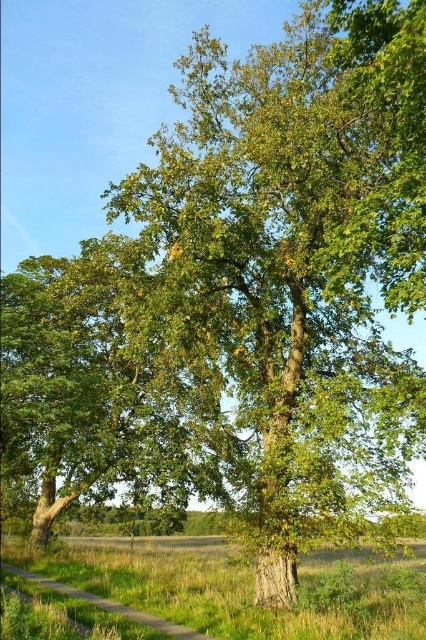
Question: Which point is farther to the camera?

Choices:
 (A) (184, 634)
 (B) (356, 612)

Answer: (A)

Question: Considering the relative positions of green grass at lower left and green grassy path at lower left in the image provided, where is green grass at lower left located with respect to green grassy path at lower left?

Choices:
 (A) left
 (B) right

Answer: (B)

Question: Is green grass at lower left to the left of green grassy path at lower left from the viewer's perspective?

Choices:
 (A) yes
 (B) no

Answer: (B)

Question: Can you confirm if green grass at lower left is positioned to the left of green grassy path at lower left?

Choices:
 (A) yes
 (B) no

Answer: (B)